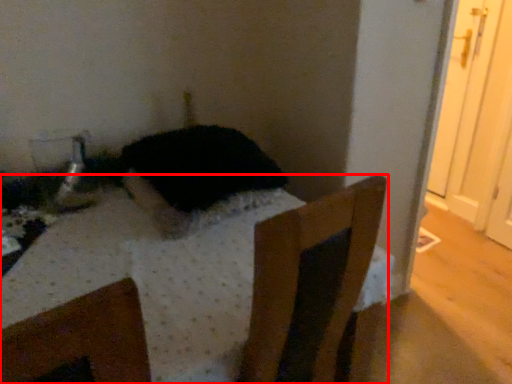
Question: Where is furniture (annotated by the red box) located in relation to animal in the image?

Choices:
 (A) left
 (B) right

Answer: (A)